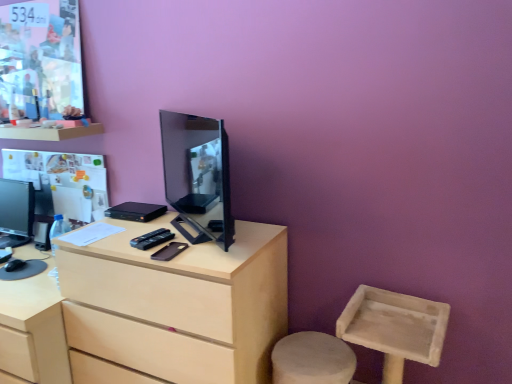
Locate an element on the screen. free space that is to the left of black plastic remote control at center is located at coordinates (119, 238).